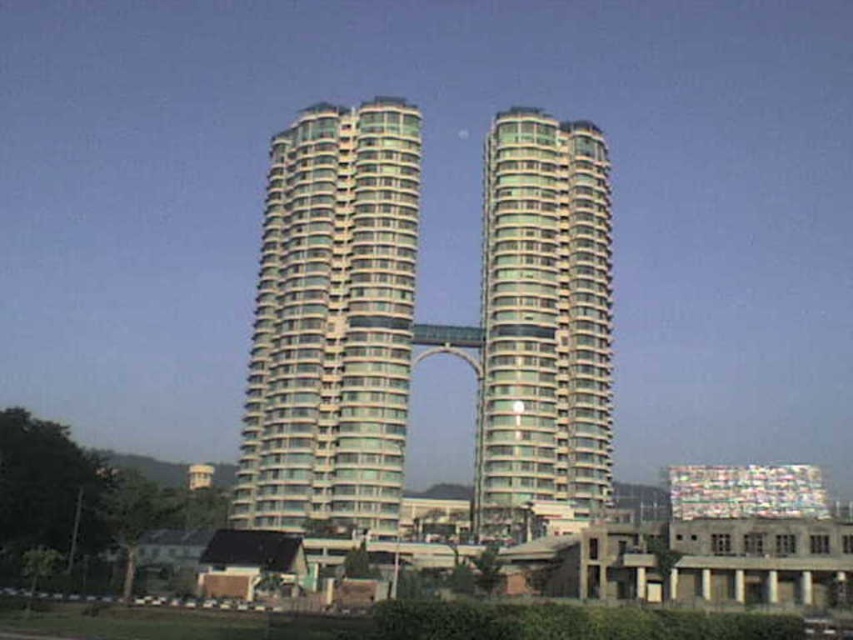
In the scene shown: You are a city planner assessing the space between two central towers. The glassy teal skyscraper at center and the glassy green tower at center. Which one is wider?

The glassy teal skyscraper at center is wider than the glassy green tower at center.

You are standing at the base of the towers and want to take a photo of the point at coordinates point (262, 403). Given that your camera has a maximum focus range of 100 meters, will you be able to focus on the point?

The distance of point (262, 403) from camera is 110.09 meters, which exceeds the camera maximum focus range of 100 meters. So you cannot focus on the point.